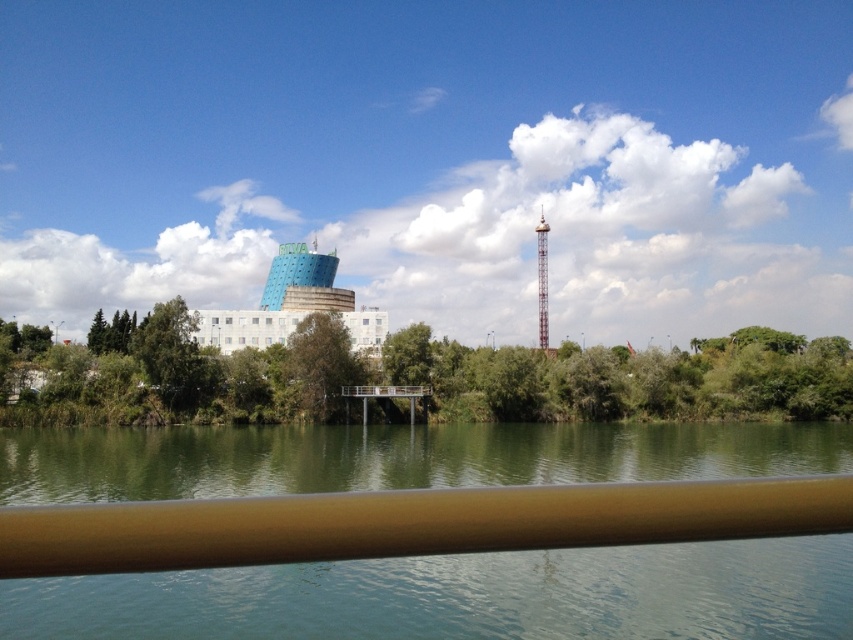
Question: Which of the following is the farthest from the observer?

Choices:
 (A) green leafy trees at center
 (B) green smooth water at center
 (C) green leafy tree at center
 (D) brown smooth rail at lower center

Answer: (C)

Question: Which of the following is the closest to the observer?

Choices:
 (A) metallic silver tower at center-right
 (B) green leafy trees at center

Answer: (B)

Question: Which of the following is the closest to the observer?

Choices:
 (A) blue glass building at center
 (B) green smooth water at center
 (C) green leafy tree at center

Answer: (B)

Question: Does green leafy trees at center appear on the left side of metallic silver tower at center-right?

Choices:
 (A) no
 (B) yes

Answer: (B)

Question: Does green leafy trees at center have a smaller size compared to brown smooth rail at lower center?

Choices:
 (A) no
 (B) yes

Answer: (A)

Question: Is the position of green smooth water at center less distant than that of green leafy tree at center?

Choices:
 (A) no
 (B) yes

Answer: (B)